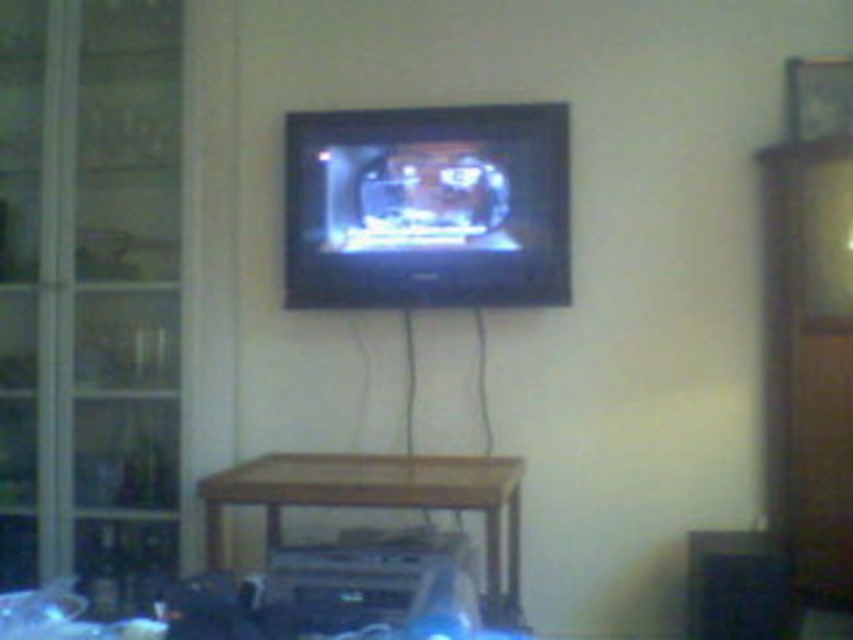
Who is positioned more to the right, matte black flat screen tv at center or wooden table at lower center?

matte black flat screen tv at center

Between matte black flat screen tv at center and wooden table at lower center, which one has less height?

wooden table at lower center is shorter.

This screenshot has width=853, height=640. I want to click on matte black flat screen tv at center, so click(x=427, y=205).